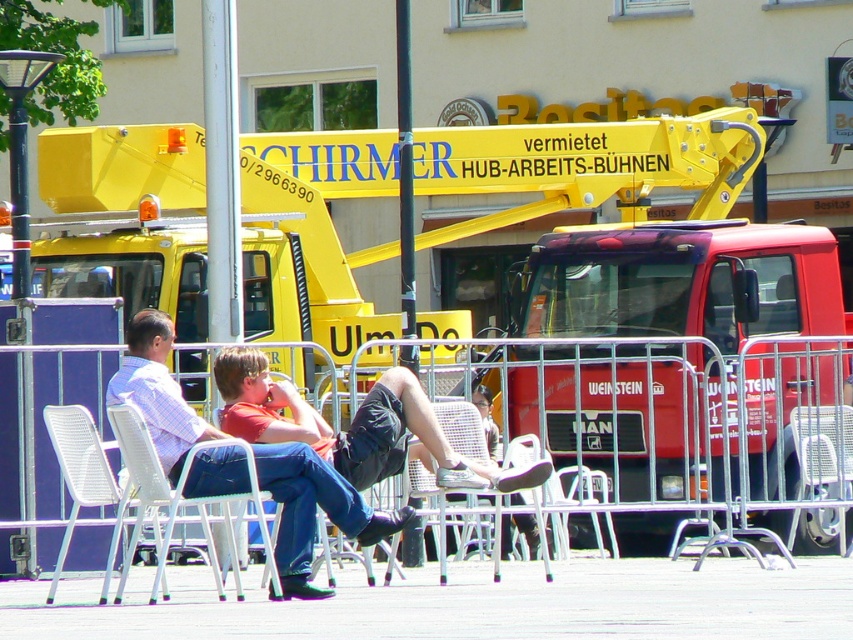
Question: Which point appears farthest from the camera in this image?

Choices:
 (A) (439, 532)
 (B) (62, 451)
 (C) (383, 525)

Answer: (A)

Question: Does red matte truck at center come in front of denim jeans at center?

Choices:
 (A) yes
 (B) no

Answer: (B)

Question: Does denim jeans at center appear under white plastic chair at lower left?

Choices:
 (A) yes
 (B) no

Answer: (B)

Question: Does red matte truck at center come in front of white mesh chair at lower left?

Choices:
 (A) no
 (B) yes

Answer: (A)

Question: Considering the real-world distances, which object is farthest from the denim jeans at center?

Choices:
 (A) white plastic chair at center
 (B) white mesh chair at lower left

Answer: (A)

Question: Estimate the real-world distances between objects in this image. Which object is farther from the yellow metallic fire truck at center?

Choices:
 (A) white plastic chair at lower left
 (B) white mesh chair at lower left

Answer: (A)